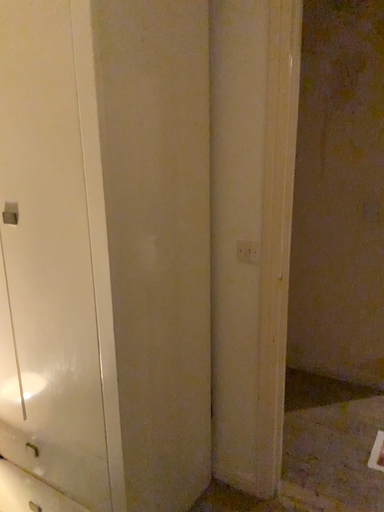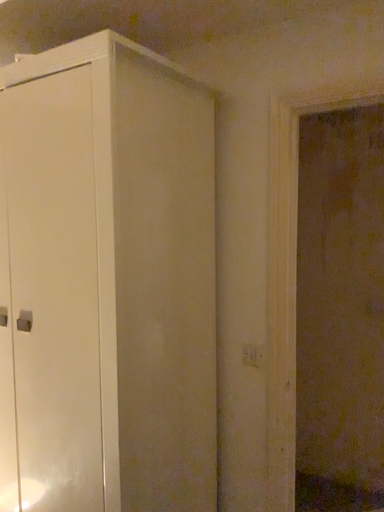
Question: How did the camera likely rotate when shooting the video?

Choices:
 (A) rotated upward
 (B) rotated downward

Answer: (A)